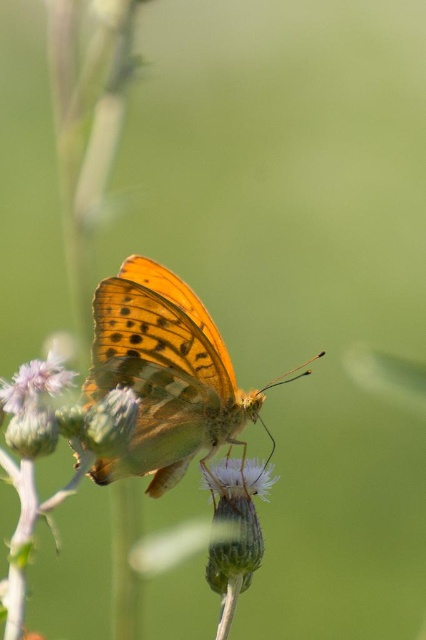
Question: Which point appears closest to the camera in this image?

Choices:
 (A) (11, 385)
 (B) (126, 388)
 (C) (230, 458)

Answer: (A)

Question: Which object is the closest to the soft purple flower at center?

Choices:
 (A) orange translucent wings at center
 (B) purple fuzzy flower at lower left

Answer: (B)

Question: Is orange translucent wings at center to the right of purple fuzzy flower at lower left from the viewer's perspective?

Choices:
 (A) yes
 (B) no

Answer: (A)

Question: Which of these objects is positioned farthest from the soft purple flower at center?

Choices:
 (A) purple fuzzy flower at lower left
 (B) orange translucent wings at center
 (C) white fuzzy flower at center

Answer: (C)

Question: Is orange translucent wings at center wider than white fuzzy flower at center?

Choices:
 (A) no
 (B) yes

Answer: (B)

Question: Does soft purple flower at center appear under purple fuzzy flower at lower left?

Choices:
 (A) yes
 (B) no

Answer: (A)